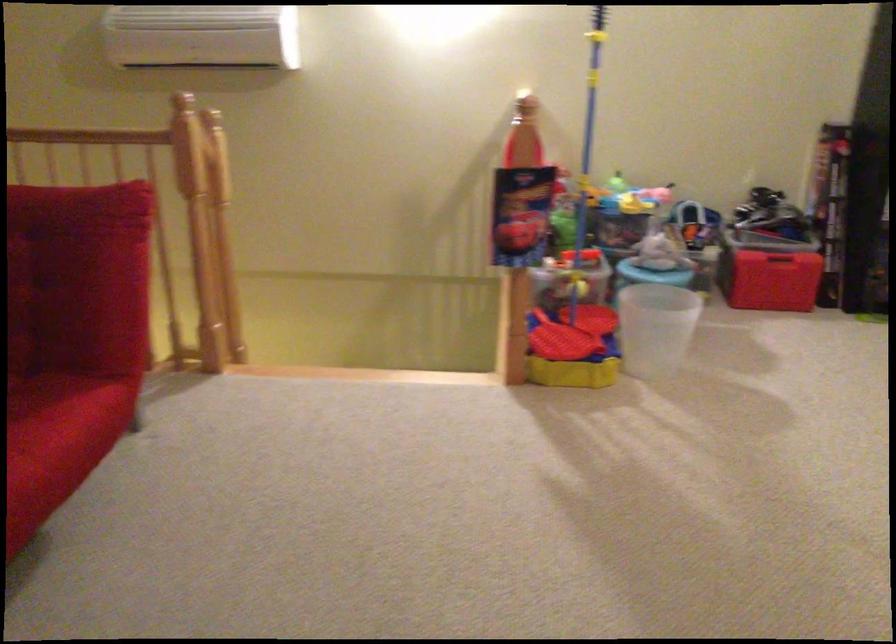
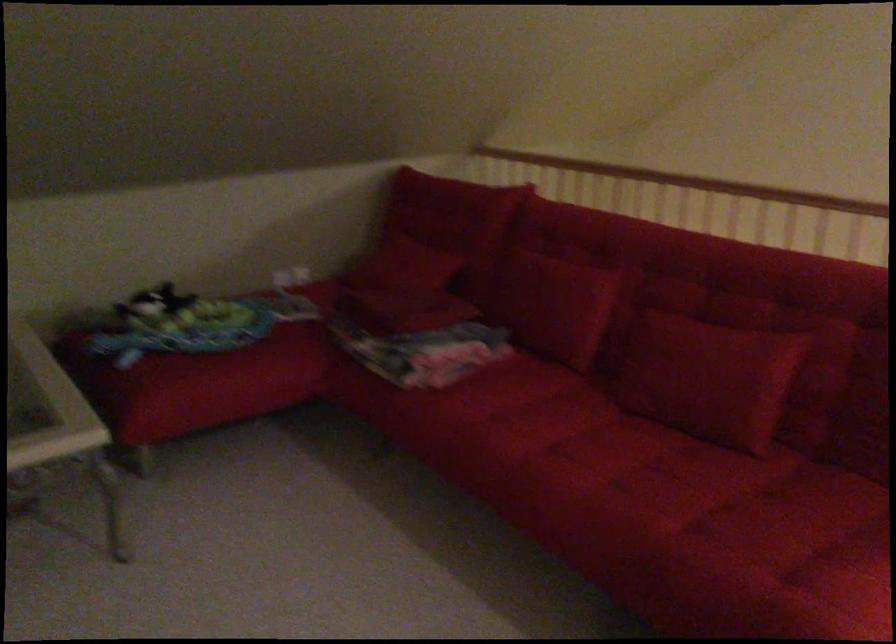
Question: The camera is either moving clockwise (left) or counter-clockwise (right) around the object. The first image is from the beginning of the video and the second image is from the end. Is the camera moving left or right when shooting the video?

Choices:
 (A) Left
 (B) Right

Answer: (B)